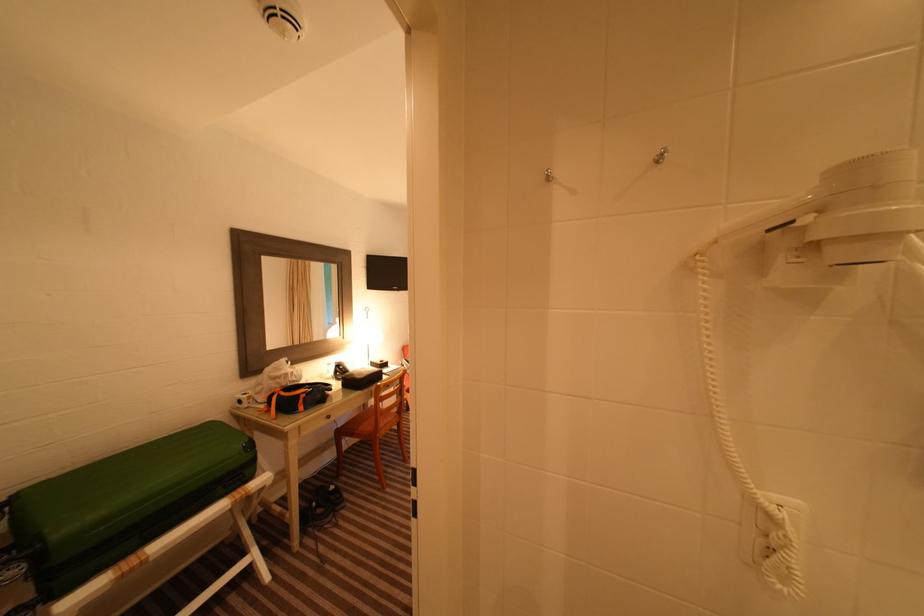
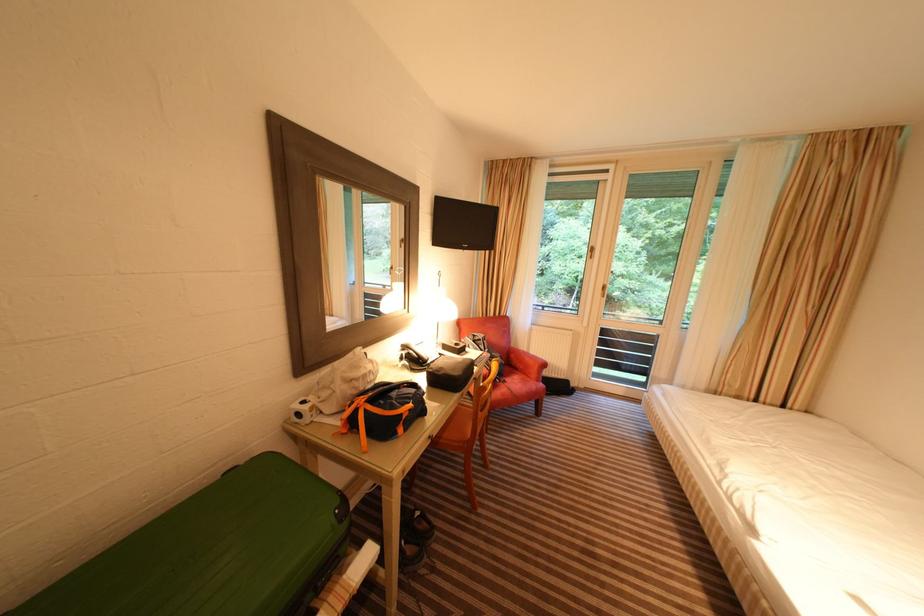
Find the pixel in the second image that matches the point at 305,398 in the first image.

(407, 416)